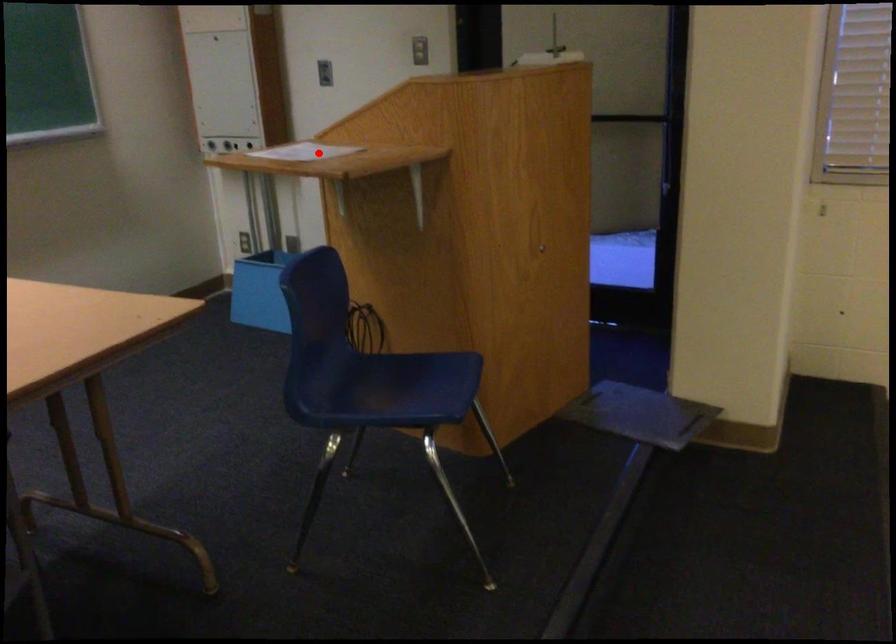
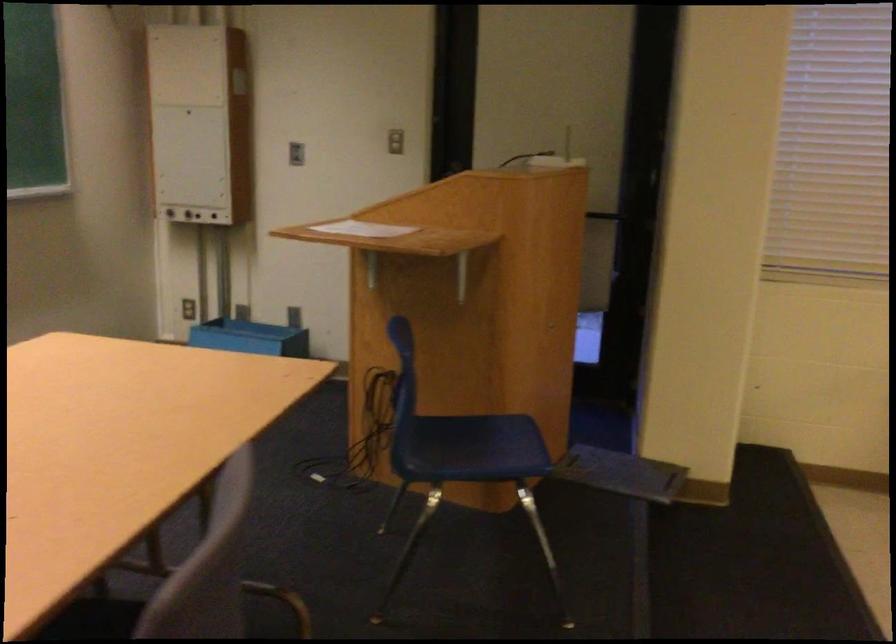
In the second image, find the point that corresponds to the highlighted location in the first image.

(362, 229)